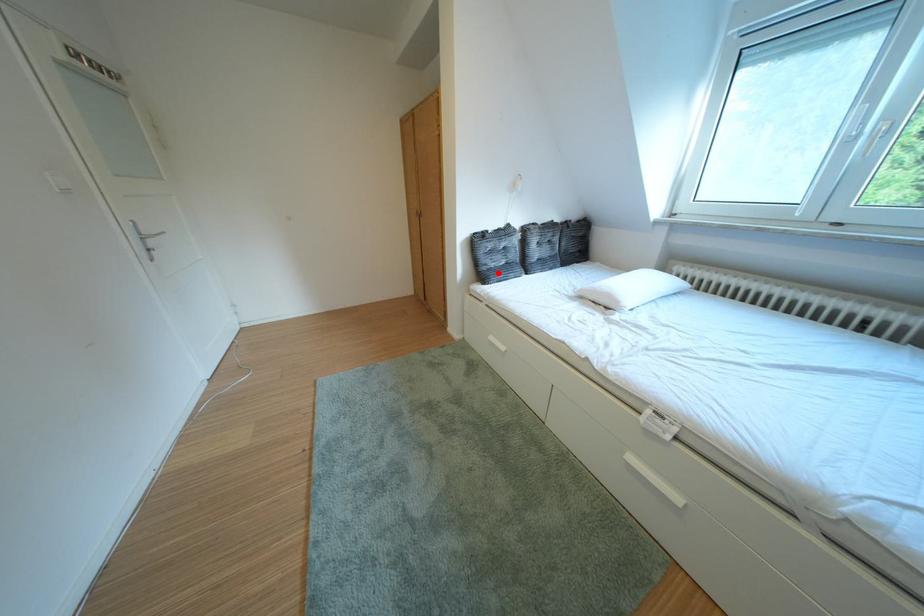
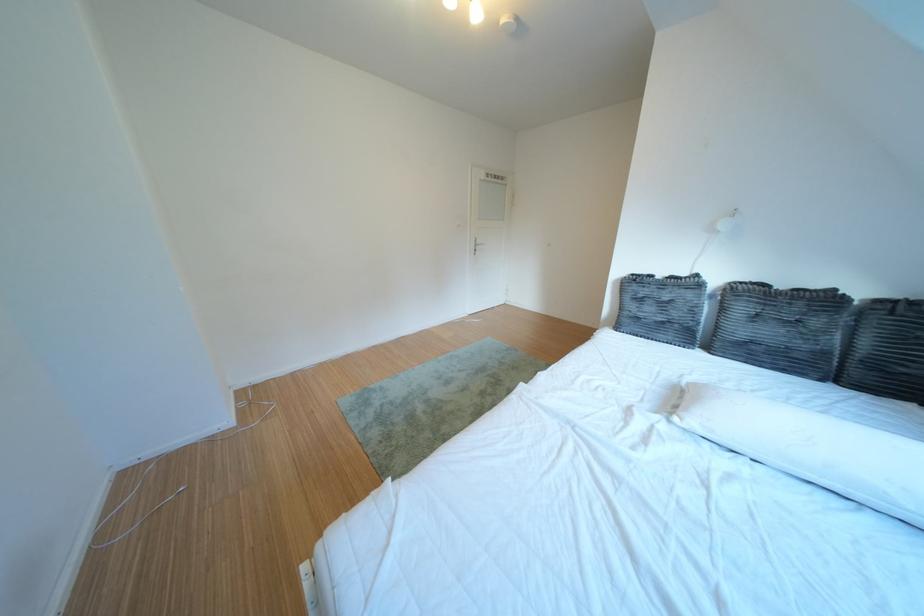
Where in the second image is the point corresponding to the highlighted location from the first image?

(639, 318)